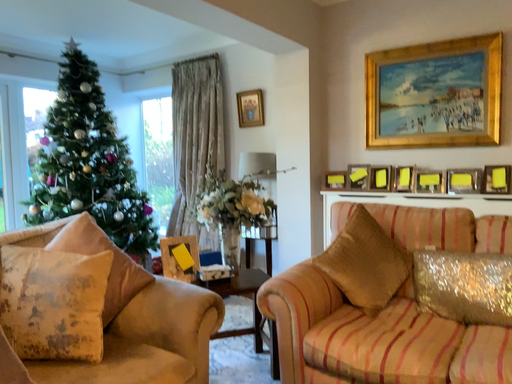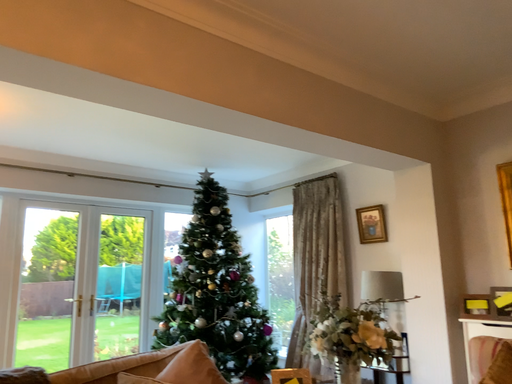
Question: How did the camera likely rotate when shooting the video?

Choices:
 (A) rotated downward
 (B) rotated upward

Answer: (B)